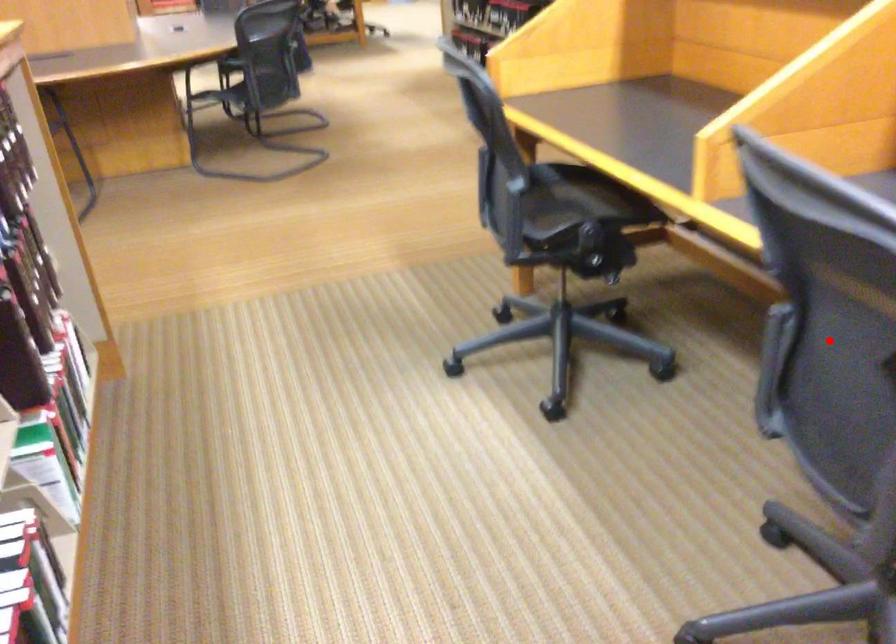
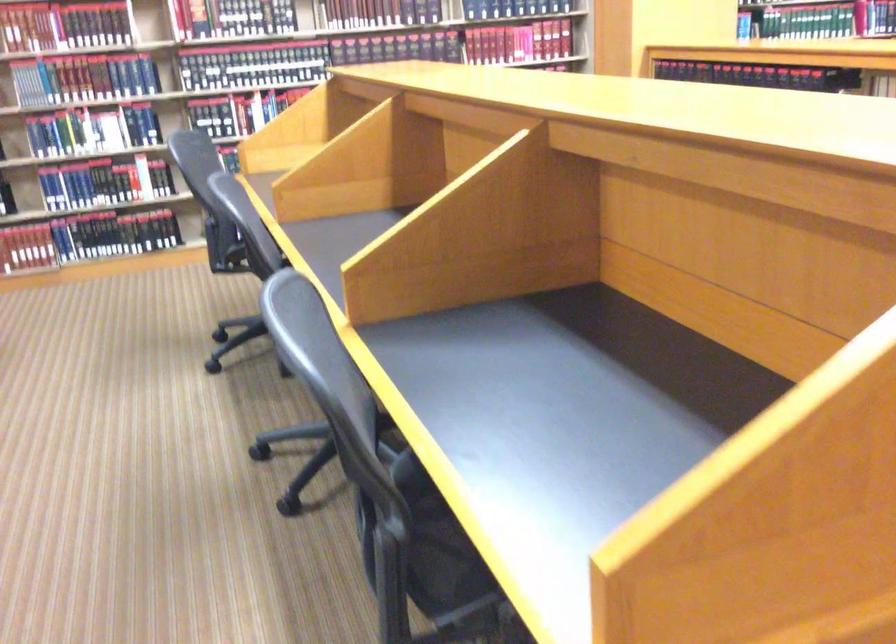
Question: I am providing you with two images of the same scene from different viewpoints. A red point is marked on the first image. Can you still see the location of the red point in image 2?

Choices:
 (A) Yes
 (B) No

Answer: (B)